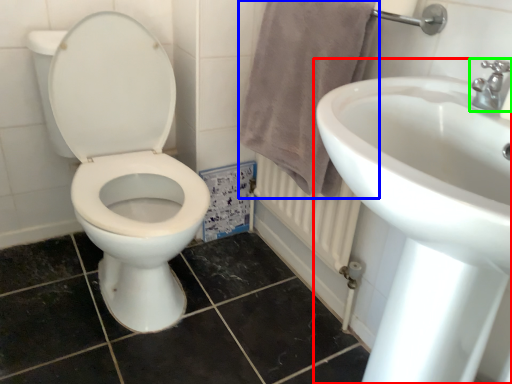
Question: Which object is positioned farthest from sink (highlighted by a red box)? Select from bath towel (highlighted by a blue box) and tap (highlighted by a green box).

Choices:
 (A) bath towel
 (B) tap

Answer: (A)